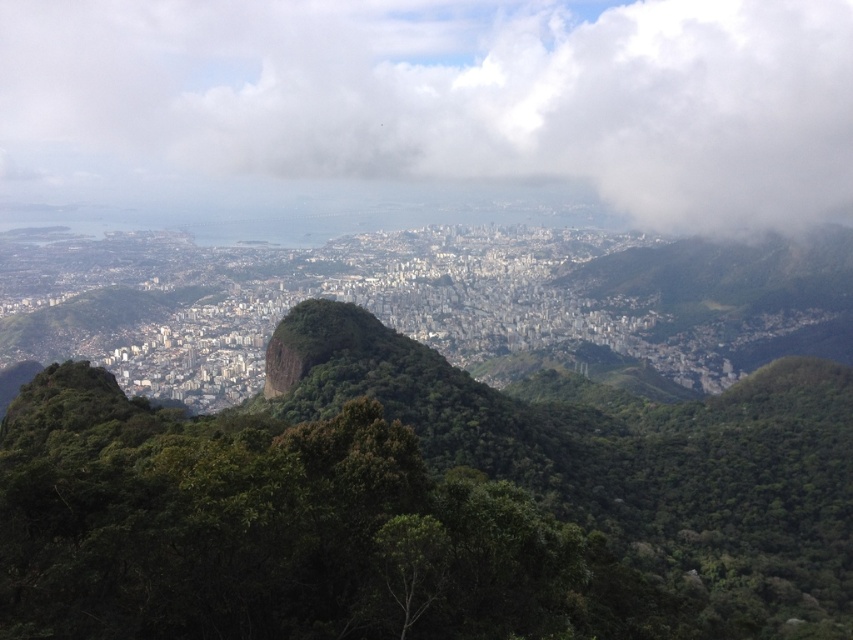
Question: Is the position of white fluffy cloud at upper center more distant than that of green rough rock at center?

Choices:
 (A) no
 (B) yes

Answer: (B)

Question: In this image, where is white fluffy cloud at upper center located relative to green rough rock at center?

Choices:
 (A) above
 (B) below

Answer: (A)

Question: Which point is farther to the camera?

Choices:
 (A) white fluffy cloud at upper center
 (B) green rough rock at center

Answer: (A)

Question: Is white fluffy cloud at upper center to the right of green rough rock at center from the viewer's perspective?

Choices:
 (A) no
 (B) yes

Answer: (B)